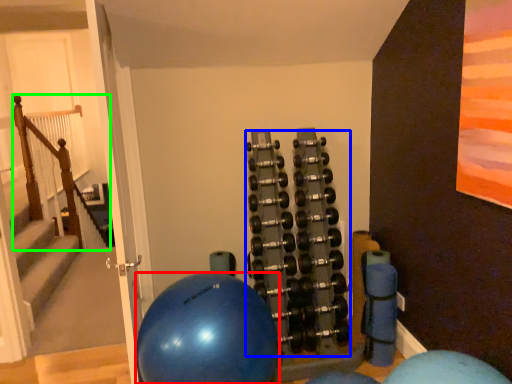
Question: Which is farther away from ball (highlighted by a red box)? dumbbell (highlighted by a blue box) or rail (highlighted by a green box)?

Choices:
 (A) dumbbell
 (B) rail

Answer: (B)